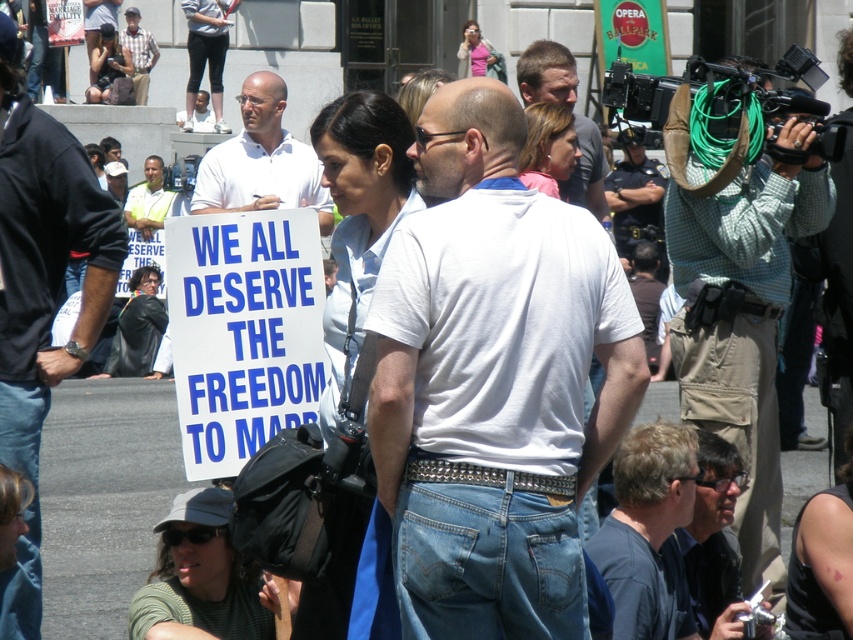
From the picture: You are a photographer at the protest, and you need to capture a photo that includes both the white matte shirt at center and the plaid shirt at upper left. Which shirt should you zoom in on to ensure both are visible in the frame?

The white matte shirt at center has a larger width than the plaid shirt at upper left, so you should zoom in on the white matte shirt at center to ensure both are visible in the frame.

You are a photographer at the protest and want to capture both the dark blue shirt at center and the light brown leather jacket at upper center in a single shot. Based on their positions, which one should you focus on first to ensure both are in frame?

The dark blue shirt at center is located below the light brown leather jacket at upper center, so you should focus on the light brown leather jacket at upper center first as it is higher up, ensuring both are within the camera frame.